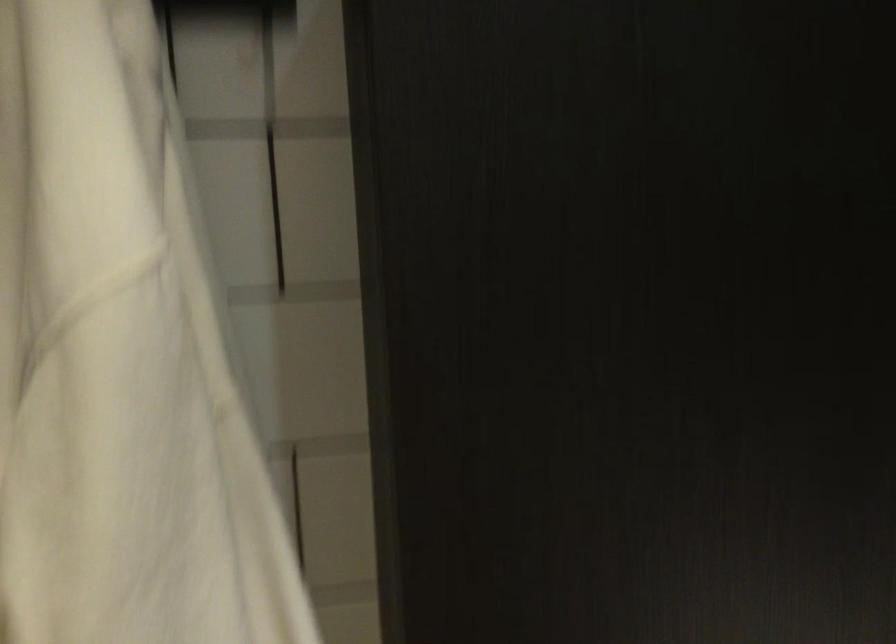
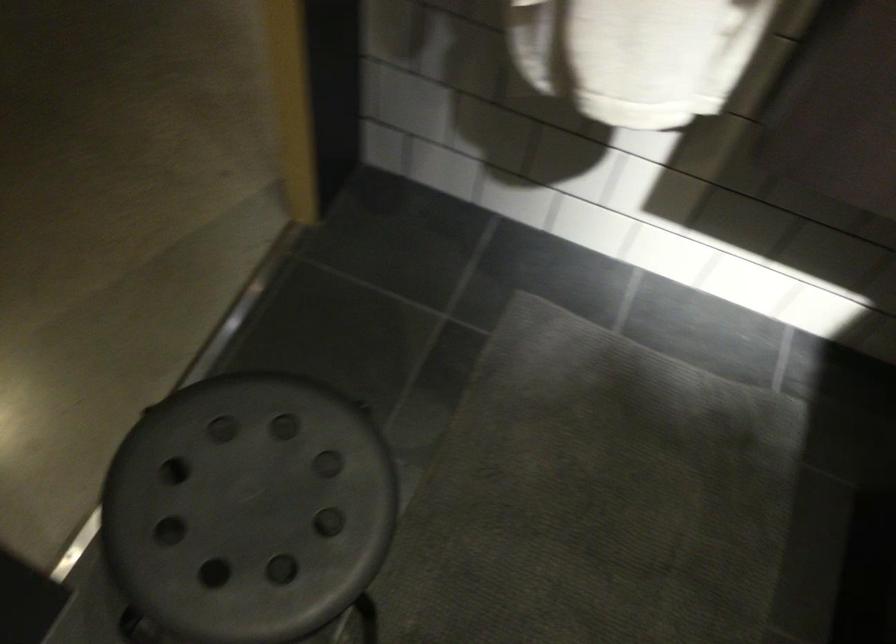
Question: Based on the continuous images, in which direction is the camera rotating? Reply with the corresponding letter.

Choices:
 (A) Left
 (B) Right
 (C) Up
 (D) Down

Answer: (D)